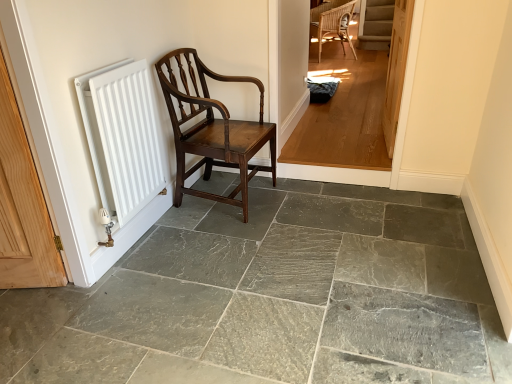
You are a GUI agent. You are given a task and a screenshot of the screen. Output one action in this format:
    pyautogui.click(x=<x>, y=<y>)
    Task: Click on the vacant space underneath white matte radiator at left (from a real-world perspective)
    
    Given the screenshot: What is the action you would take?
    pyautogui.click(x=138, y=241)